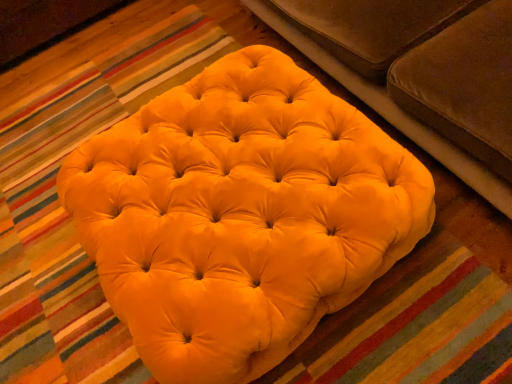
Question: In terms of size, does velvet brown studio couch at upper center appear bigger or smaller than matte yellow ottoman at center?

Choices:
 (A) small
 (B) big

Answer: (B)

Question: Would you say velvet brown studio couch at upper center is to the left or to the right of matte yellow ottoman at center in the picture?

Choices:
 (A) right
 (B) left

Answer: (A)

Question: From a real-world perspective, is velvet brown studio couch at upper center physically located above or below matte yellow ottoman at center?

Choices:
 (A) below
 (B) above

Answer: (B)

Question: Considering the positions of matte yellow ottoman at center and velvet brown studio couch at upper center in the image, is matte yellow ottoman at center taller or shorter than velvet brown studio couch at upper center?

Choices:
 (A) tall
 (B) short

Answer: (B)

Question: Looking at their shapes, would you say matte yellow ottoman at center is wider or thinner than velvet brown studio couch at upper center?

Choices:
 (A) wide
 (B) thin

Answer: (B)

Question: Is matte yellow ottoman at center spatially inside velvet brown studio couch at upper center, or outside of it?

Choices:
 (A) inside
 (B) outside

Answer: (B)

Question: Does point (238, 62) appear closer or farther from the camera than point (359, 82)?

Choices:
 (A) farther
 (B) closer

Answer: (B)